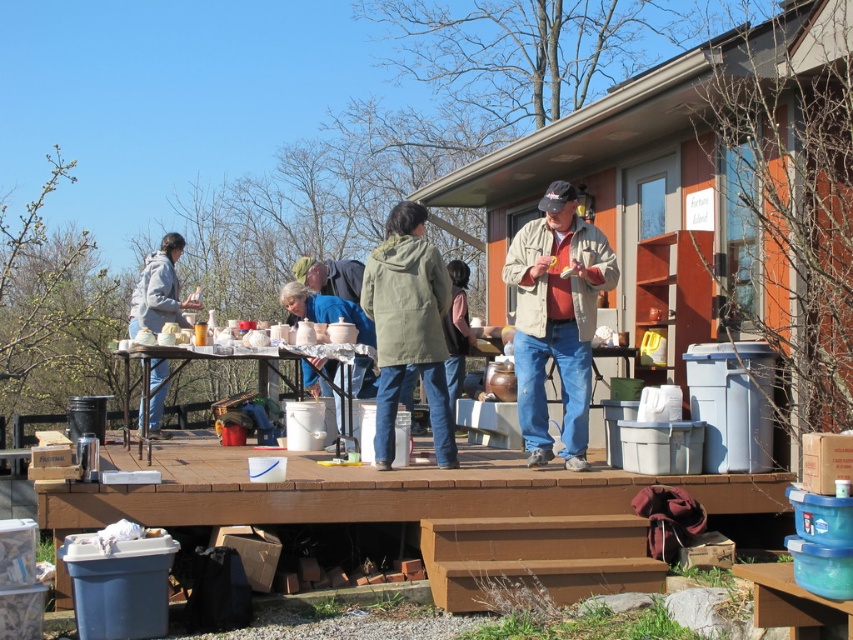
You are standing at the edge of the scene and want to place a small potted plant between the brown wood deck at lower center and the matte gray jacket at center. Which object should the plant be closer to?

The plant should be placed closer to the brown wood deck at lower center because it is nearer to the viewer compared to the matte gray jacket at center.

You are a photographer trying to capture a photo of the brown wood deck at lower center and the denim jacket at center. Based on their sizes in the image, which object should you focus on first if you want to ensure both are in frame without moving the camera?

The brown wood deck at lower center is shorter than the denim jacket at center, so you should focus on the denim jacket at center first since it is taller and might require more attention to fit within the frame properly.

You are planning to place a 3ft wide wooden bench on the brown wood deck at lower center. Considering the deck and the matte gray jacket at center, will the bench fit on the deck without overlapping the jacket?

The brown wood deck at lower center has a width larger than the matte gray jacket at center, so the bench can be placed on the deck as long as it is positioned away from the jacket to avoid overlapping.